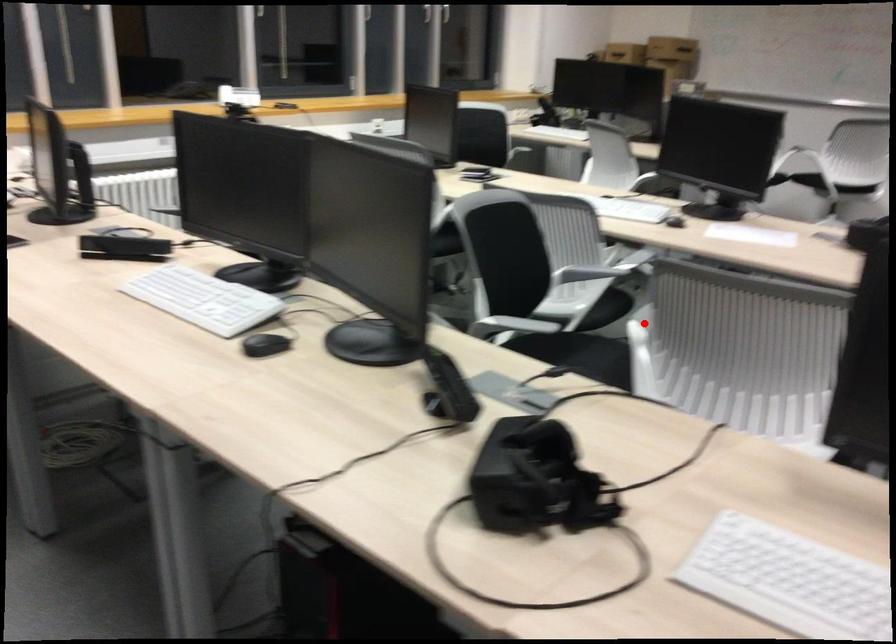
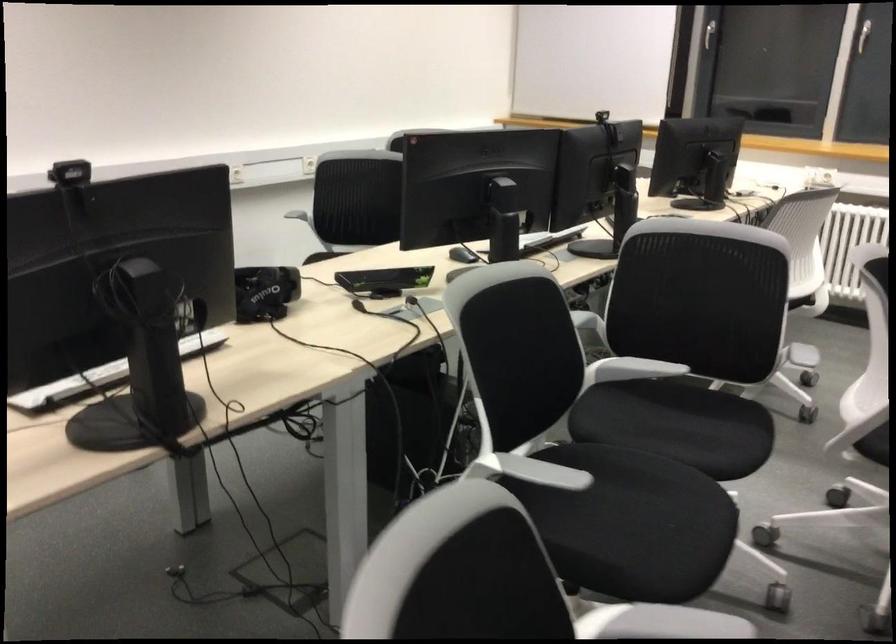
Find the pixel in the second image that matches the highlighted location in the first image.

(631, 368)